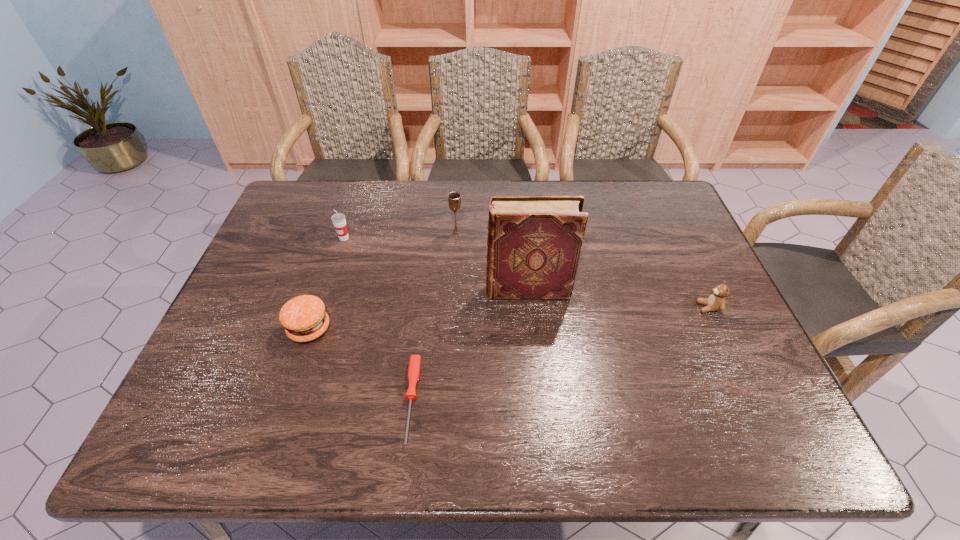
Locate an element on the screen. The height and width of the screenshot is (540, 960). free space between the patty and the hardback book is located at coordinates (419, 309).

Locate an element on the screen. Image resolution: width=960 pixels, height=540 pixels. free area in between the teddy bear and the hardback book is located at coordinates (618, 299).

What are the coordinates of `free spot between the patty and the nearest object` in the screenshot? It's located at (361, 364).

Locate an element on the screen. The height and width of the screenshot is (540, 960). vacant space that is in between the rightmost object and the hardback book is located at coordinates (x=618, y=299).

Image resolution: width=960 pixels, height=540 pixels. Identify the location of vacant space in between the third tallest object and the fourth object from right to left. (378, 319).

The width and height of the screenshot is (960, 540). What are the coordinates of `free area in between the rightmost object and the nearest object` in the screenshot? It's located at (560, 354).

Identify which object is the second nearest to the patty. Please provide its 2D coordinates. Your answer should be formatted as a tuple, i.e. [(x, y)], where the tuple contains the x and y coordinates of a point satisfying the conditions above.

[(338, 219)]

You are a GUI agent. You are given a task and a screenshot of the screen. Output one action in this format:
    pyautogui.click(x=<x>, y=<y>)
    Task: Click on the object that is the fifth closest one to the third object from right to left
    
    Given the screenshot: What is the action you would take?
    click(x=716, y=301)